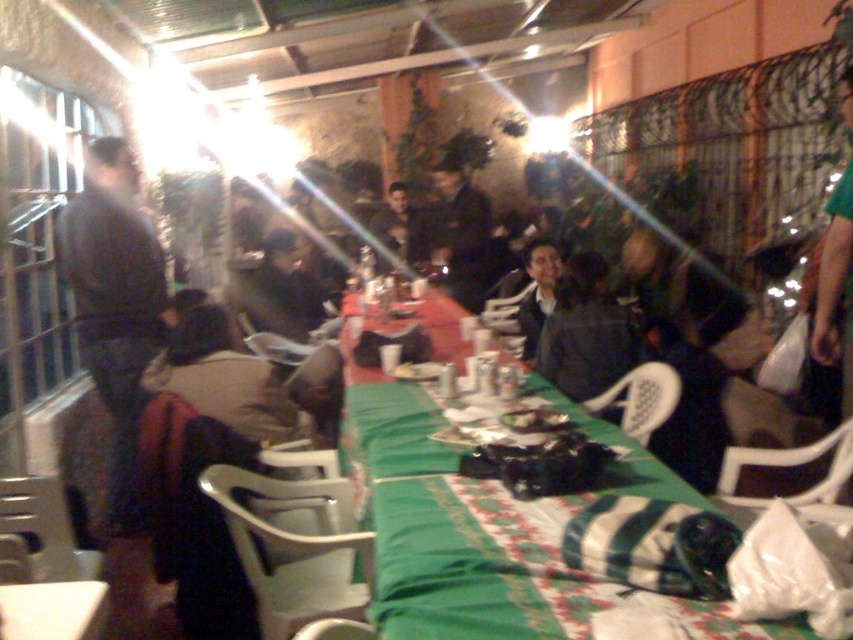
You are a guest at this outdoor gathering and need to place a small gift on the table. Considering the sizes of the dark gray sweater at left and the green fabric table at lower left, which object can accommodate the gift without overlapping with the other items?

The green fabric table at lower left can accommodate the gift without overlapping with other items because the dark gray sweater at left is larger and may take up more space.

You are a guest at this outdoor gathering and want to pick up your dark brown leather jacket at center and dark gray jacket at center. Which one do you need to reach further to get?

The dark gray jacket at center requires reaching further because it is farther from the viewer compared to the dark brown leather jacket at center.